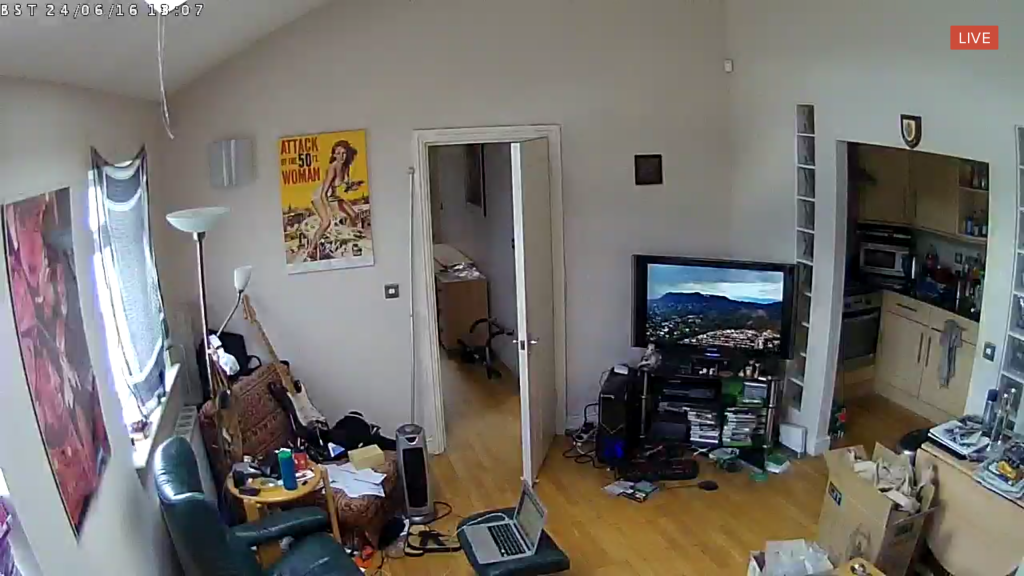
Locate an element on the screen. The height and width of the screenshot is (576, 1024). dish towel is located at coordinates (946, 354).